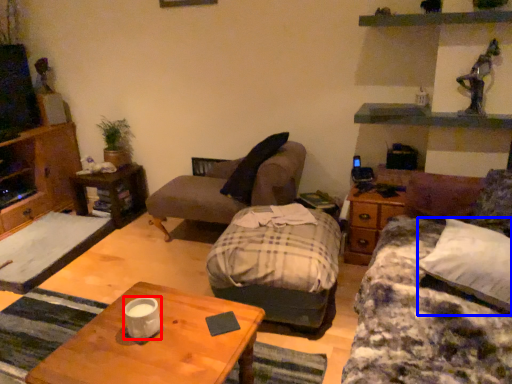
Question: Which object is further to the camera taking this photo, coffee cup (highlighted by a red box) or pillow (highlighted by a blue box)?

Choices:
 (A) coffee cup
 (B) pillow

Answer: (A)